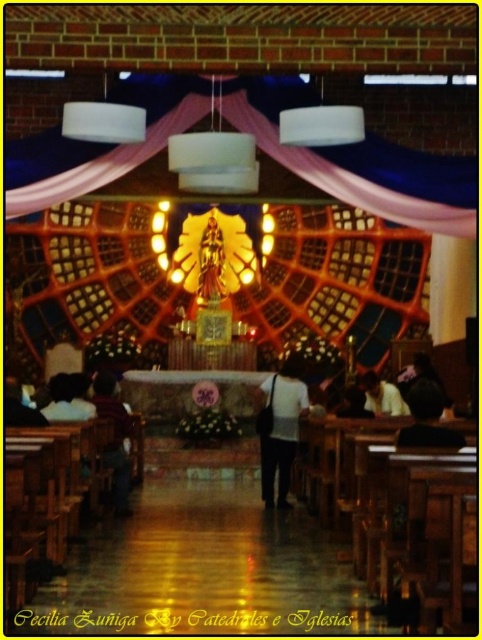
Which is behind, point (281, 371) or point (445, 436)?

Positioned behind is point (281, 371).

Does white matte shirt at center appear on the right side of dark brown hair at lower right?

In fact, white matte shirt at center is to the left of dark brown hair at lower right.

At what (x,y) coordinates should I click in order to perform the action: click on white matte shirt at center. Please return your answer as a coordinate pair (x, y). The width and height of the screenshot is (482, 640). Looking at the image, I should click on (280, 426).

Does white matte shirt at center come in front of white fabric bag at lower center?

Yes, it is in front of white fabric bag at lower center.

The width and height of the screenshot is (482, 640). I want to click on white matte shirt at center, so click(280, 426).

Which is above, dark brown leather jacket at lower left or dark brown hair at lower right?

dark brown hair at lower right is higher up.

Can you confirm if dark brown leather jacket at lower left is bigger than dark brown hair at lower right?

Actually, dark brown leather jacket at lower left might be smaller than dark brown hair at lower right.

Is point (109, 396) positioned behind point (430, 408)?

Yes, it is behind point (430, 408).

In order to click on dark brown leather jacket at lower left in this screenshot , I will do `click(114, 436)`.